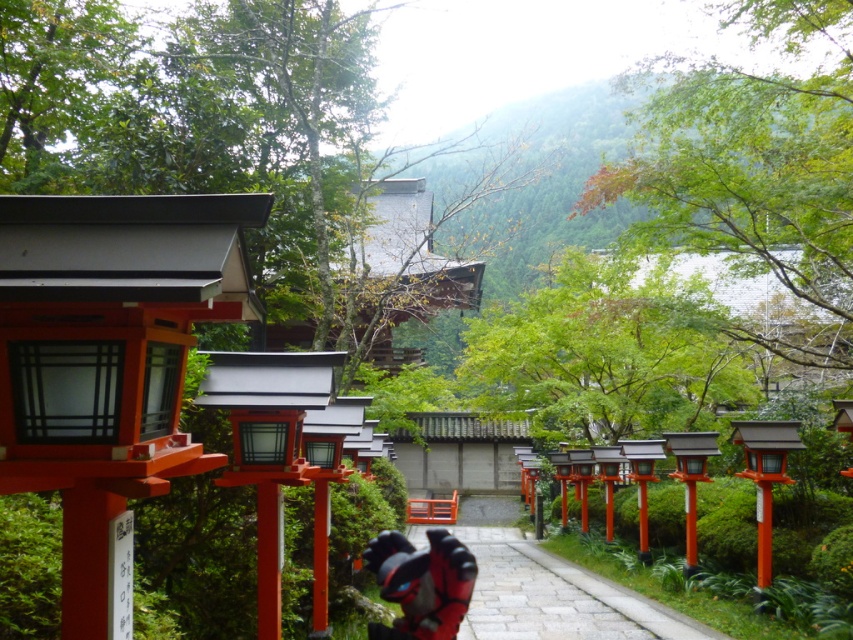
Question: Which point is farther to the camera?

Choices:
 (A) (469, 584)
 (B) (593, 625)

Answer: (B)

Question: Is smooth stone path at center further to the viewer compared to shiny red helmet at center?

Choices:
 (A) no
 (B) yes

Answer: (B)

Question: Among these objects, which one is nearest to the camera?

Choices:
 (A) shiny red helmet at center
 (B) smooth stone path at center

Answer: (A)

Question: Does smooth stone path at center come in front of shiny red helmet at center?

Choices:
 (A) yes
 (B) no

Answer: (B)

Question: Which point is farther to the camera?

Choices:
 (A) shiny red helmet at center
 (B) smooth stone path at center

Answer: (B)

Question: Observing the image, what is the correct spatial positioning of smooth stone path at center in reference to shiny red helmet at center?

Choices:
 (A) left
 (B) right

Answer: (B)